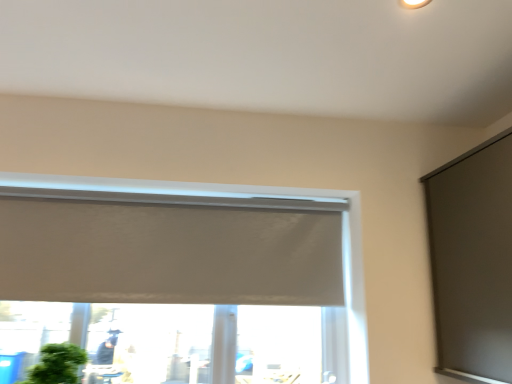
Question: From a real-world perspective, is green matte houseplant at lower left physically below matte gray screen at right?

Choices:
 (A) no
 (B) yes

Answer: (B)

Question: Is green matte houseplant at lower left facing towards matte gray screen at right?

Choices:
 (A) no
 (B) yes

Answer: (A)

Question: From the image's perspective, is green matte houseplant at lower left on matte gray screen at right?

Choices:
 (A) no
 (B) yes

Answer: (A)

Question: Is matte gray screen at right a part of green matte houseplant at lower left?

Choices:
 (A) no
 (B) yes

Answer: (A)

Question: From the image's perspective, is green matte houseplant at lower left located beneath matte gray screen at right?

Choices:
 (A) no
 (B) yes

Answer: (B)

Question: Does green matte houseplant at lower left come behind matte gray screen at right?

Choices:
 (A) yes
 (B) no

Answer: (A)

Question: From a real-world perspective, is matte gray screen at right positioned under green matte houseplant at lower left based on gravity?

Choices:
 (A) no
 (B) yes

Answer: (A)

Question: Is matte gray screen at right not within green matte houseplant at lower left?

Choices:
 (A) yes
 (B) no

Answer: (A)

Question: Is matte gray screen at right positioned behind green matte houseplant at lower left?

Choices:
 (A) yes
 (B) no

Answer: (B)

Question: Does matte gray screen at right have a lesser width compared to green matte houseplant at lower left?

Choices:
 (A) yes
 (B) no

Answer: (B)

Question: Is matte gray screen at right with green matte houseplant at lower left?

Choices:
 (A) no
 (B) yes

Answer: (A)

Question: From the image's perspective, is matte gray screen at right located above green matte houseplant at lower left?

Choices:
 (A) yes
 (B) no

Answer: (A)

Question: From a real-world perspective, is matte gray screen at right positioned under white matte window at center based on gravity?

Choices:
 (A) yes
 (B) no

Answer: (B)